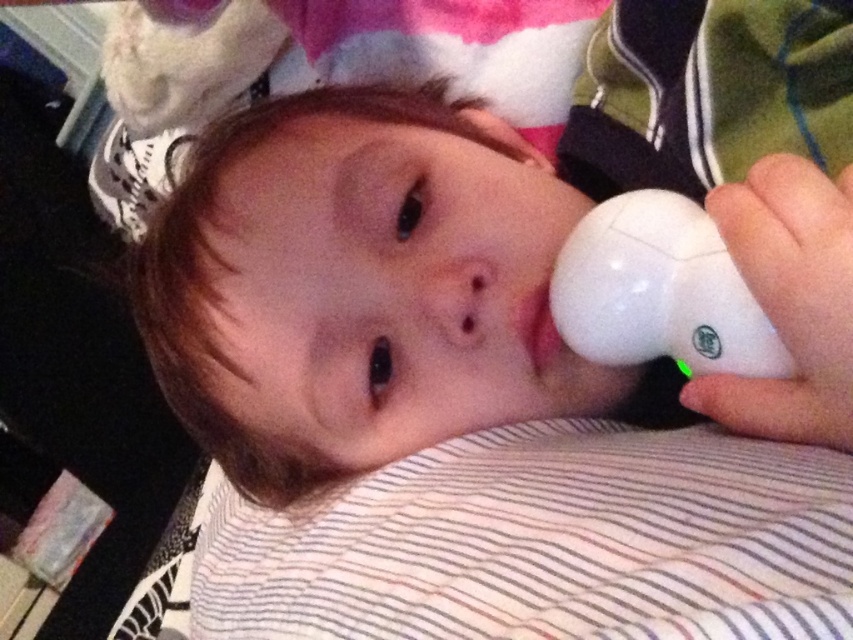
You are a caregiver entering the room and see the white matte pacifier at center. Where should you place it after cleaning?

The white matte pacifier at center should be placed back at its original location at point (x=451, y=240).

You are a parent trying to choose between the white matte pacifier at center and the white matte remote control at lower right to hand to your child. The child is lying on the bed. Which object is taller and therefore might be harder for the child to grasp?

The white matte pacifier at center is taller than the white matte remote control at lower right, so it might be harder for the child to grasp.